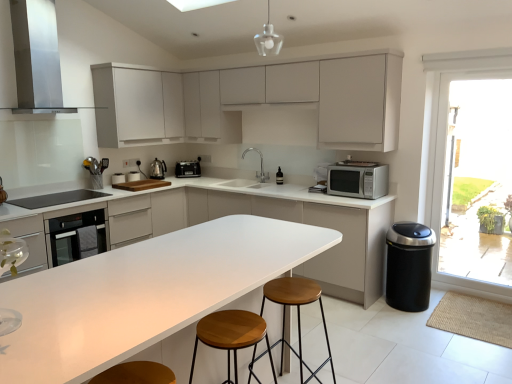
Question: In terms of size, does stainless steel range hood at upper left appear bigger or smaller than white matte cabinet at center, the third cabinetry when ordered from top to bottom?

Choices:
 (A) small
 (B) big

Answer: (A)

Question: In the image, is stainless steel range hood at upper left positioned in front of or behind white matte cabinet at center, placed as the 1th cabinetry when sorted from bottom to top?

Choices:
 (A) front
 (B) behind

Answer: (A)

Question: Which object is positioned farthest from the satin silver microwave at right?

Choices:
 (A) white matte cabinet at upper center, acting as the third cabinetry starting from the bottom
 (B) wooden stool at center, the second stool in the front-to-back sequence
 (C) white matte cabinet at upper center, positioned as the second cabinetry in bottom-to-top order
 (D) matte glass pendant at upper center
 (E) wooden stool at center, arranged as the second stool when viewed from the back

Answer: (A)

Question: Which object is the closest to the white laminate countertop at center?

Choices:
 (A) black glass cooktop at left
 (B) wooden stool at center, arranged as the second stool when viewed from the back
 (C) silver metallic faucet at center
 (D) wooden stool at center, the 1th stool in the back-to-front sequence
 (E) satin silver microwave at right

Answer: (B)